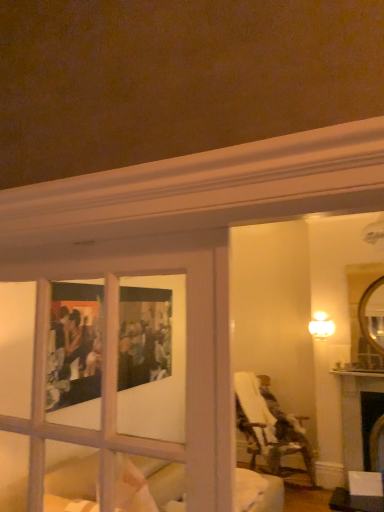
Question: Is plaid fabric chair at right shorter than white glossy light fixture at upper right?

Choices:
 (A) no
 (B) yes

Answer: (A)

Question: Is the depth of plaid fabric chair at right greater than that of white glossy light fixture at upper right?

Choices:
 (A) yes
 (B) no

Answer: (B)

Question: Would you say white glossy light fixture at upper right is part of plaid fabric chair at right's contents?

Choices:
 (A) yes
 (B) no

Answer: (B)

Question: Is plaid fabric chair at right at the left side of white glossy light fixture at upper right?

Choices:
 (A) yes
 (B) no

Answer: (A)

Question: Is plaid fabric chair at right positioned beyond the bounds of white glossy light fixture at upper right?

Choices:
 (A) no
 (B) yes

Answer: (B)

Question: Is plaid fabric chair at right closer to the viewer compared to white glossy light fixture at upper right?

Choices:
 (A) yes
 (B) no

Answer: (A)

Question: Is white glossy light fixture at upper right at the left side of plaid fabric chair at right?

Choices:
 (A) yes
 (B) no

Answer: (B)

Question: Considering the relative sizes of white glossy light fixture at upper right and plaid fabric chair at right in the image provided, is white glossy light fixture at upper right taller than plaid fabric chair at right?

Choices:
 (A) yes
 (B) no

Answer: (B)

Question: From the image's perspective, would you say white glossy light fixture at upper right is shown under plaid fabric chair at right?

Choices:
 (A) yes
 (B) no

Answer: (B)

Question: Considering the relative sizes of white glossy light fixture at upper right and plaid fabric chair at right in the image provided, is white glossy light fixture at upper right smaller than plaid fabric chair at right?

Choices:
 (A) yes
 (B) no

Answer: (A)

Question: Is plaid fabric chair at right surrounded by white glossy light fixture at upper right?

Choices:
 (A) yes
 (B) no

Answer: (B)

Question: Is white glossy light fixture at upper right bigger than plaid fabric chair at right?

Choices:
 (A) yes
 (B) no

Answer: (B)

Question: From the image's perspective, relative to white glossy light fixture at upper right, is plaid fabric chair at right above or below?

Choices:
 (A) above
 (B) below

Answer: (B)